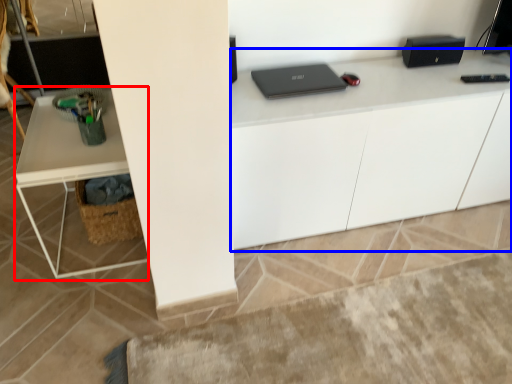
Question: Which object appears farthest to the camera in this image, computer desk (highlighted by a red box) or computer desk (highlighted by a blue box)?

Choices:
 (A) computer desk
 (B) computer desk

Answer: (B)